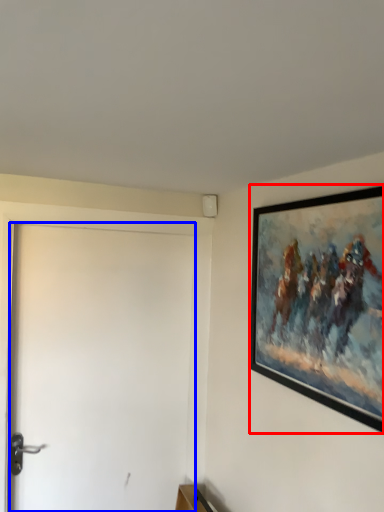
Question: Which object appears closest to the camera in this image, picture frame (highlighted by a red box) or door (highlighted by a blue box)?

Choices:
 (A) picture frame
 (B) door

Answer: (A)